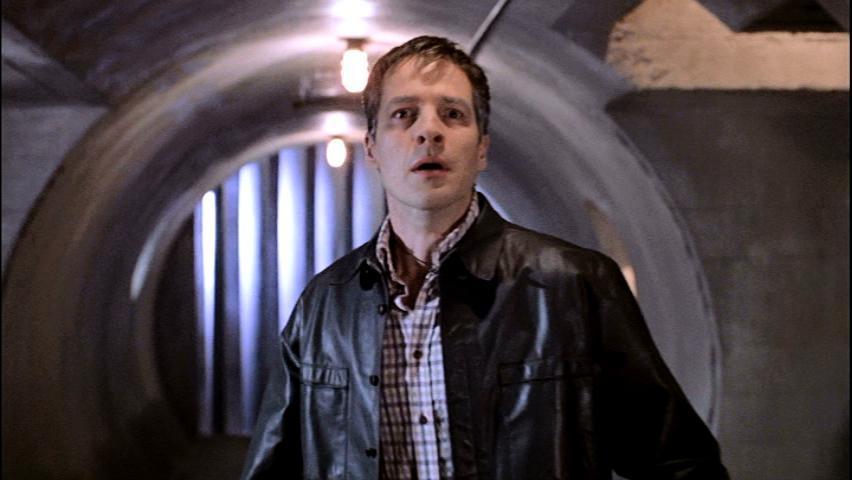
The width and height of the screenshot is (852, 480). What are the coordinates of `illuminated light bulbs` in the screenshot? It's located at (354, 66), (338, 150).